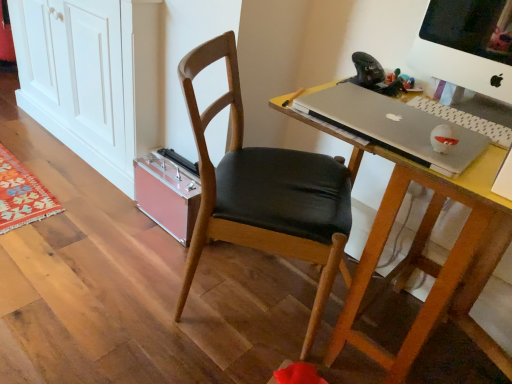
Where is `wooden desk at center`? Image resolution: width=512 pixels, height=384 pixels. wooden desk at center is located at coordinates (425, 256).

The height and width of the screenshot is (384, 512). Describe the element at coordinates (90, 77) in the screenshot. I see `pink plastic cabinet at lower left` at that location.

You are a GUI agent. You are given a task and a screenshot of the screen. Output one action in this format:
    pyautogui.click(x=<x>, y=<y>)
    Task: Click on the white plastic computer monitor at upper right
    This screenshot has width=512, height=384.
    Given the screenshot: What is the action you would take?
    pyautogui.click(x=468, y=45)

Considering the positions of objects wooden chair at center and silver metallic laptop at center in the image provided, who is in front, wooden chair at center or silver metallic laptop at center?

Positioned in front is silver metallic laptop at center.

Is wooden chair at center to the right of silver metallic laptop at center from the viewer's perspective?

No.

How different are the orientations of wooden chair at center and silver metallic laptop at center in degrees?

The angle between the facing direction of wooden chair at center and the facing direction of silver metallic laptop at center is 121 degrees.

Could you tell me if white plastic computer monitor at upper right is facing wooden chair at center?

No, white plastic computer monitor at upper right is not aimed at wooden chair at center.

Does white plastic computer monitor at upper right have a greater width compared to wooden chair at center?

In fact, white plastic computer monitor at upper right might be narrower than wooden chair at center.

Considering the relative sizes of white plastic computer monitor at upper right and wooden chair at center in the image provided, is white plastic computer monitor at upper right shorter than wooden chair at center?

Yes.

Measure the distance between white plastic computer monitor at upper right and wooden chair at center.

white plastic computer monitor at upper right is 22.39 inches from wooden chair at center.

Is wooden desk at center located within silver metallic laptop at center?

No, wooden desk at center is located outside of silver metallic laptop at center.

Is there a large distance between silver metallic laptop at center and wooden desk at center?

They are positioned close to each other.

Is wooden chair at center at the back of silver metallic laptop at center?

No, wooden chair at center is not at the back of silver metallic laptop at center.

Considering the relative sizes of silver metallic laptop at center and wooden chair at center in the image provided, is silver metallic laptop at center taller than wooden chair at center?

No.

Considering their positions, is silver metallic laptop at center located in front of or behind wooden chair at center?

Visually, silver metallic laptop at center is located in front of wooden chair at center.

Can you confirm if silver metallic laptop at center is thinner than wooden chair at center?

Correct, the width of silver metallic laptop at center is less than that of wooden chair at center.

Considering the sizes of objects gray matte laptop keyboard at right and white plastic computer monitor at upper right in the image provided, who is smaller, gray matte laptop keyboard at right or white plastic computer monitor at upper right?

gray matte laptop keyboard at right.

Does gray matte laptop keyboard at right come in front of white plastic computer monitor at upper right?

Yes.

Find the location of a particular element. computer monitor above the gray matte laptop keyboard at right (from a real-world perspective) is located at coordinates (468, 45).

Considering the relative sizes of gray matte laptop keyboard at right and white plastic computer monitor at upper right in the image provided, is gray matte laptop keyboard at right wider than white plastic computer monitor at upper right?

No, gray matte laptop keyboard at right is not wider than white plastic computer monitor at upper right.

Can you tell me how much silver metallic laptop at center and pink plastic cabinet at lower left differ in facing direction?

2.33 degrees separate the facing orientations of silver metallic laptop at center and pink plastic cabinet at lower left.

Can you confirm if silver metallic laptop at center is smaller than pink plastic cabinet at lower left?

Indeed, silver metallic laptop at center has a smaller size compared to pink plastic cabinet at lower left.

Is silver metallic laptop at center inside the boundaries of pink plastic cabinet at lower left, or outside?

silver metallic laptop at center exists outside the volume of pink plastic cabinet at lower left.

Between silver metallic laptop at center and pink plastic cabinet at lower left, which one is positioned behind?

pink plastic cabinet at lower left is more distant.

Which is in front, point (475, 71) or point (493, 251)?

The point (475, 71) is closer.

Which is more to the left, white plastic computer monitor at upper right or wooden desk at center?

From the viewer's perspective, wooden desk at center appears more on the left side.

Is white plastic computer monitor at upper right surrounding wooden desk at center?

No, wooden desk at center is not a part of white plastic computer monitor at upper right.

Find the location of a particular element. The height and width of the screenshot is (384, 512). chair below the silver metallic laptop at center (from the image's perspective) is located at coordinates (265, 191).

There is a wooden chair at center. Find the location of `computer monitor above it (from a real-world perspective)`. computer monitor above it (from a real-world perspective) is located at coordinates (468, 45).

Which object lies further to the anchor point white plastic computer monitor at upper right, silver metallic laptop at center or wooden desk at center?

wooden desk at center lies further to white plastic computer monitor at upper right than the other object.

Based on their spatial positions, is silver metallic laptop at center or pink plastic cabinet at lower left closer to gray matte laptop keyboard at right?

Among the two, silver metallic laptop at center is located nearer to gray matte laptop keyboard at right.

Consider the image. From the image, which object appears to be nearer to white plastic computer monitor at upper right, pink plastic cabinet at lower left or wooden chair at center?

wooden chair at center is positioned closer to the anchor white plastic computer monitor at upper right.

Estimate the real-world distances between objects in this image. Which object is closer to gray matte laptop keyboard at right, wooden desk at center or silver metallic laptop at center?

Based on the image, silver metallic laptop at center appears to be nearer to gray matte laptop keyboard at right.

Looking at the image, which one is located closer to white plastic computer monitor at upper right, wooden desk at center or wooden chair at center?

wooden desk at center lies closer to white plastic computer monitor at upper right than the other object.

Looking at the image, which one is located closer to silver metallic laptop at center, wooden chair at center or gray matte laptop keyboard at right?

gray matte laptop keyboard at right is closer to silver metallic laptop at center.

Based on their spatial positions, is white plastic computer monitor at upper right or pink plastic cabinet at lower left closer to wooden desk at center?

Among the two, white plastic computer monitor at upper right is located nearer to wooden desk at center.

Looking at the image, which one is located further to wooden desk at center, silver metallic laptop at center or wooden chair at center?

Among the two, wooden chair at center is located further to wooden desk at center.

I want to click on chair between pink plastic cabinet at lower left and wooden desk at center in the horizontal direction, so point(265,191).

Locate an element on the screen. laptop keyboard between pink plastic cabinet at lower left and white plastic computer monitor at upper right in the horizontal direction is located at coordinates (465, 120).

The height and width of the screenshot is (384, 512). In order to click on laptop situated between wooden chair at center and gray matte laptop keyboard at right from left to right in this screenshot , I will do click(392, 126).

Where is `chair between pink plastic cabinet at lower left and white plastic computer monitor at upper right from left to right`? chair between pink plastic cabinet at lower left and white plastic computer monitor at upper right from left to right is located at coordinates (265, 191).